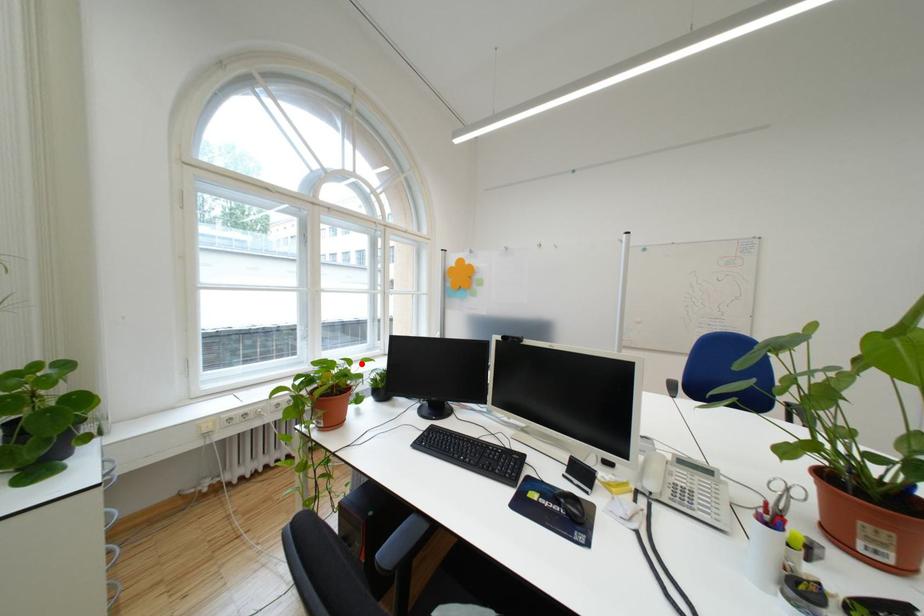
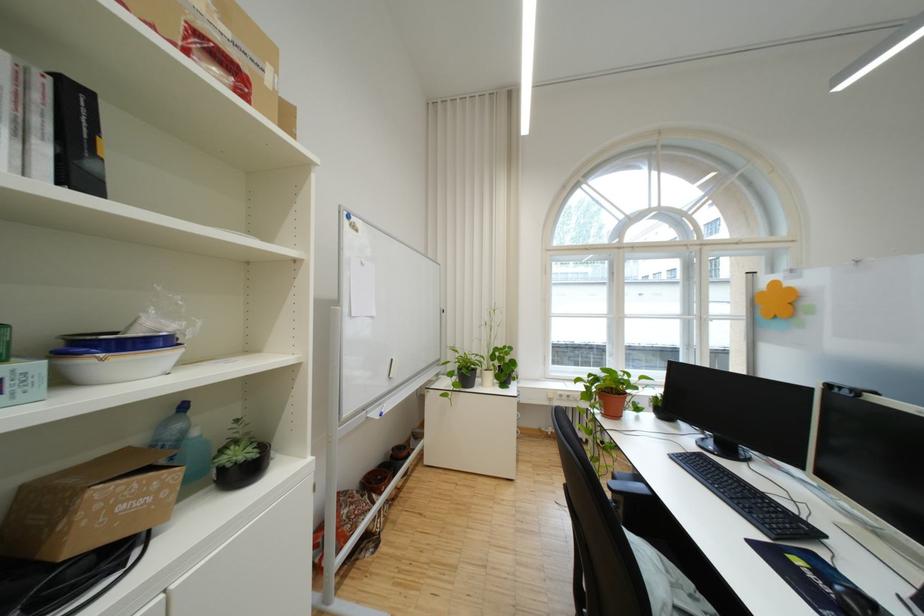
Question: I am providing you with two images of the same scene from different viewpoints. A red point is shown in image1. For the corresponding object point in image2, is it positioned nearer or farther from the camera?

Choices:
 (A) Nearer
 (B) Farther

Answer: (B)